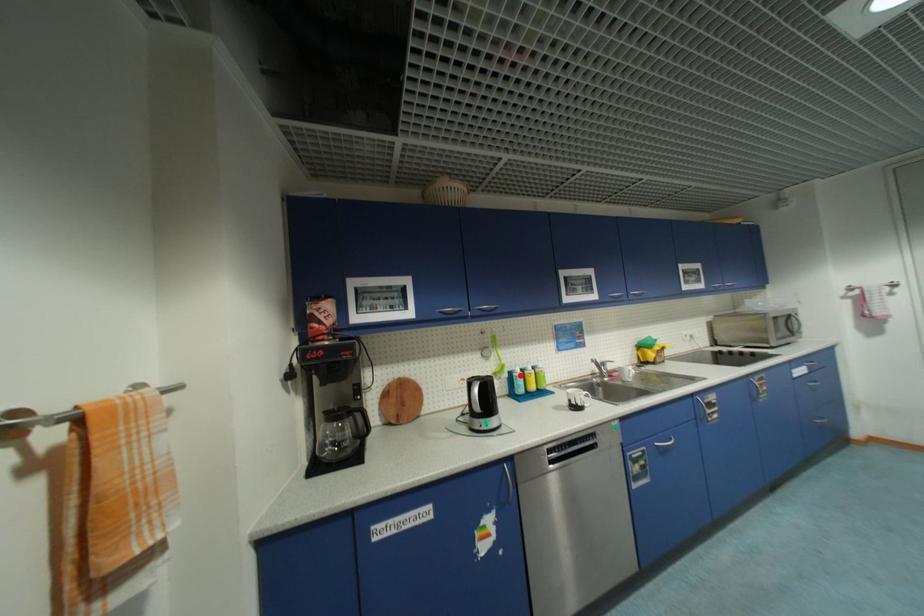
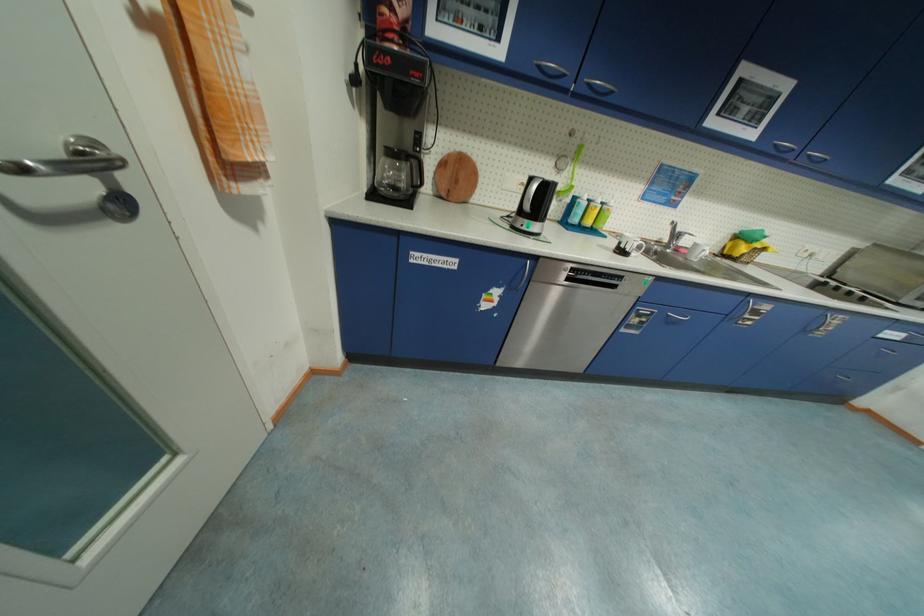
Question: A red point is marked in image1. In image2, is the corresponding 3D point closer to the camera or farther? Reply with the corresponding letter.

Choices:
 (A) The corresponding 3D point is closer.
 (B) The corresponding 3D point is farther.

Answer: (A)